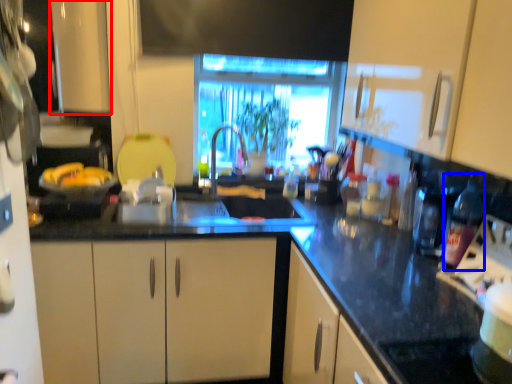
Question: Which object is closer to the camera taking this photo, cabinetry (highlighted by a red box) or bottle (highlighted by a blue box)?

Choices:
 (A) cabinetry
 (B) bottle

Answer: (B)